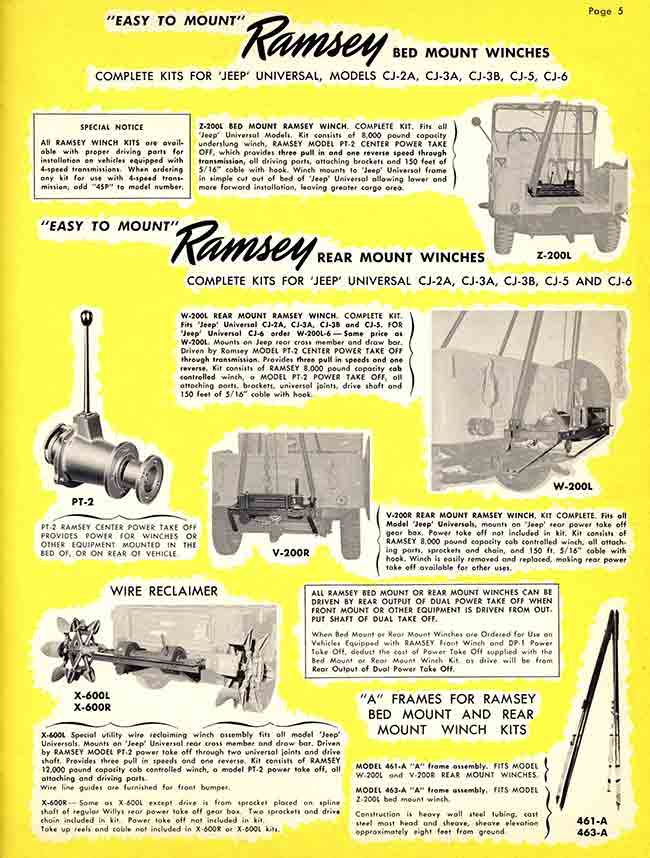
The height and width of the screenshot is (858, 650). Find the location of `window`. window is located at coordinates (517, 118).